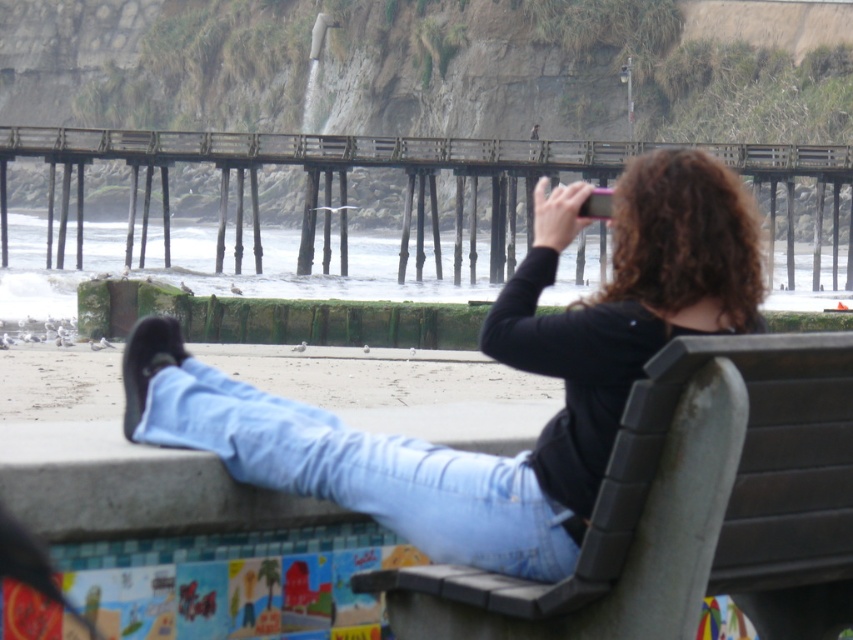
Looking at this image, is black matte shirt at upper center shorter than wooden pier at center?

Correct, black matte shirt at upper center is not as tall as wooden pier at center.

Does black matte shirt at upper center have a lesser width compared to wooden pier at center?

Indeed, black matte shirt at upper center has a lesser width compared to wooden pier at center.

Measure the distance between point [641,205] and camera.

The distance of point [641,205] from camera is 6.68 meters.

Identify the location of black matte shirt at upper center. (502, 362).

Can you confirm if black matte shirt at upper center is thinner than light blue denim jeans at lower center?

No.

Is black matte shirt at upper center to the left of light blue denim jeans at lower center from the viewer's perspective?

Correct, you'll find black matte shirt at upper center to the left of light blue denim jeans at lower center.

Where is `black matte shirt at upper center`? The image size is (853, 640). black matte shirt at upper center is located at coordinates (502, 362).

You are a GUI agent. You are given a task and a screenshot of the screen. Output one action in this format:
    pyautogui.click(x=<x>, y=<y>)
    Task: Click on the black matte shirt at upper center
    The width and height of the screenshot is (853, 640).
    Given the screenshot: What is the action you would take?
    pyautogui.click(x=502, y=362)

Is light blue denim jeans at lower center further to the viewer compared to wooden pier at center?

No, light blue denim jeans at lower center is in front of wooden pier at center.

Is light blue denim jeans at lower center bigger than wooden pier at center?

Incorrect, light blue denim jeans at lower center is not larger than wooden pier at center.

Which is behind, point (457, 515) or point (759, 172)?

Point (759, 172)

The image size is (853, 640). Identify the location of light blue denim jeans at lower center. (366, 472).